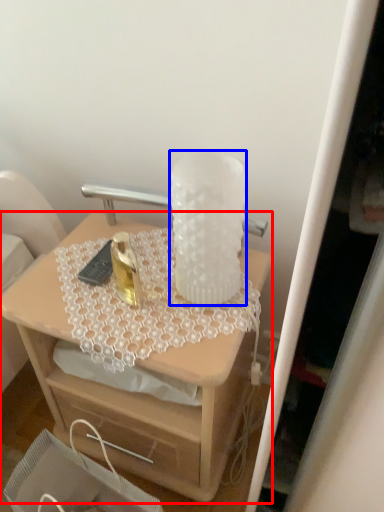
Question: Among these objects, which one is farthest to the camera, desk (highlighted by a red box) or vase (highlighted by a blue box)?

Choices:
 (A) desk
 (B) vase

Answer: (A)